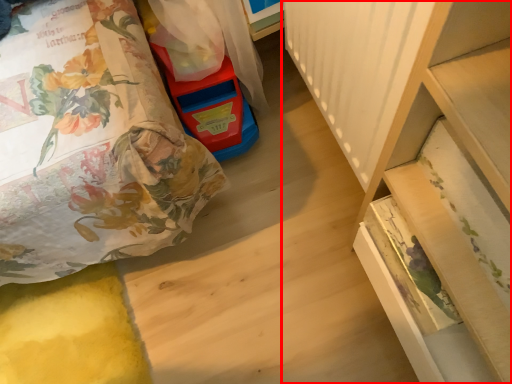
Question: From the image, what is the correct spatial relationship of furniture (annotated by the red box) in relation to toy?

Choices:
 (A) left
 (B) right

Answer: (B)